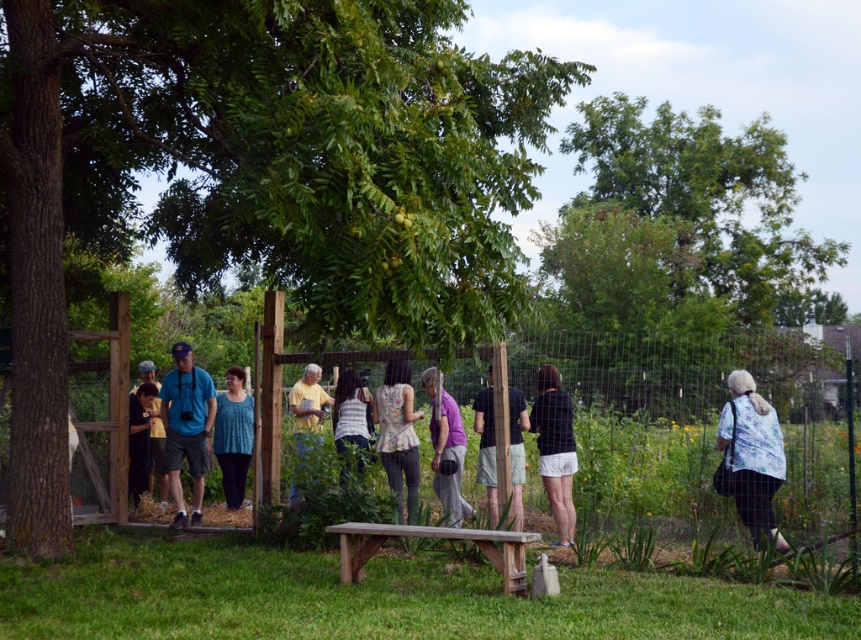
Between white floral shirt at lower right and matte black shirt at center, which one appears on the right side from the viewer's perspective?

white floral shirt at lower right is more to the right.

Is white floral shirt at lower right further to camera compared to matte black shirt at center?

No, it is in front of matte black shirt at center.

Is point (748, 442) positioned before point (132, 483)?

That is True.

The image size is (861, 640). I want to click on white floral shirt at lower right, so click(753, 456).

Is point (759, 145) closer to viewer compared to point (460, 435)?

No, it is behind (460, 435).

Who is taller, green leafy tree at upper center or purple fabric shirt at center?

green leafy tree at upper center

The height and width of the screenshot is (640, 861). Find the location of `green leafy tree at upper center`. green leafy tree at upper center is located at coordinates [x=677, y=225].

Does wire mesh fence at center appear on the left side of green leafy tree at upper center?

Yes, wire mesh fence at center is to the left of green leafy tree at upper center.

This screenshot has height=640, width=861. Describe the element at coordinates (703, 422) in the screenshot. I see `wire mesh fence at center` at that location.

Who is more forward, (810,406) or (601,108)?

Point (810,406)

You are a GUI agent. You are given a task and a screenshot of the screen. Output one action in this format:
    pyautogui.click(x=<x>, y=<y>)
    Task: Click on the wire mesh fence at center
    This screenshot has width=861, height=640.
    Given the screenshot: What is the action you would take?
    pyautogui.click(x=703, y=422)